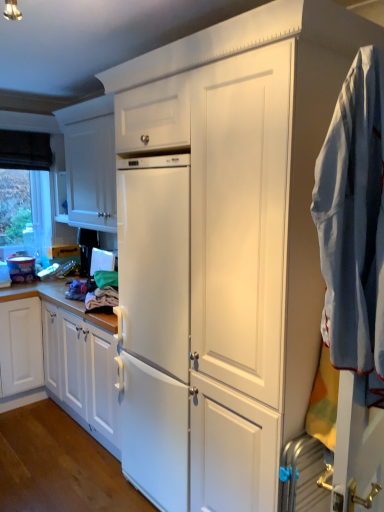
Question: From the image's perspective, relative to light blue cotton shirt at right, is transparent glass window at upper left above or below?

Choices:
 (A) above
 (B) below

Answer: (A)

Question: Is point (18, 204) closer or farther from the camera than point (362, 244)?

Choices:
 (A) farther
 (B) closer

Answer: (A)

Question: Which of these objects is positioned closest to the white matte cabinet at upper left?

Choices:
 (A) light blue cotton shirt at right
 (B) transparent glass window at upper left

Answer: (B)

Question: Based on their relative distances, which object is farther from the light blue cotton shirt at right?

Choices:
 (A) white matte cabinet at upper left
 (B) transparent glass window at upper left

Answer: (B)